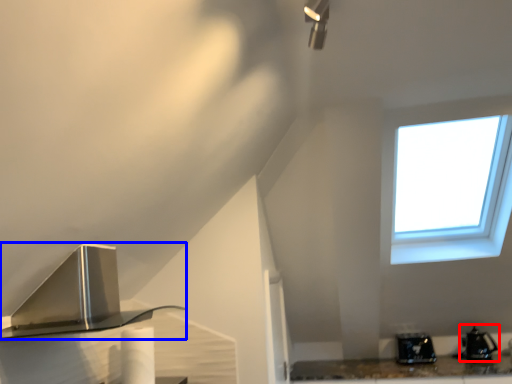
Question: Which object is further to the camera taking this photo, appliance (highlighted by a red box) or kitchen appliance (highlighted by a blue box)?

Choices:
 (A) appliance
 (B) kitchen appliance

Answer: (A)